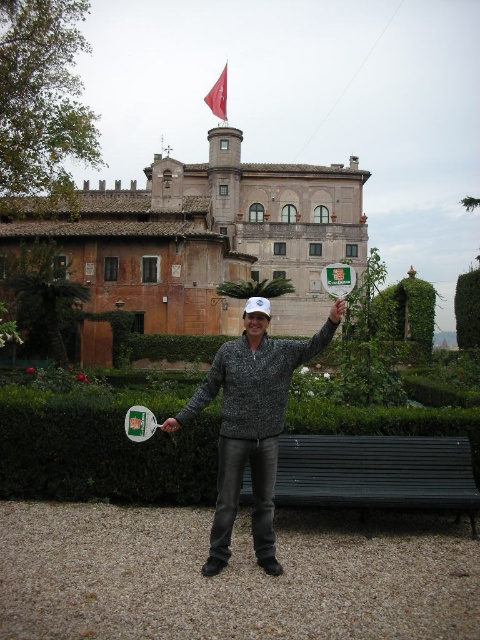
You are a photographer trying to capture the man in the speckled sweater at center and the green leafy hedge at center in the same frame. Which object is shorter?

The speckled sweater at center is shorter than the green leafy hedge at center.

You are a photographer trying to capture the brown stone building at upper center and the speckled sweater at center in the same frame. Based on their positions, which object should you focus on first to ensure both are in focus?

The brown stone building at upper center should be focused on first since the speckled sweater at center is behind it, meaning adjusting focus starting from the farther object will help both be in focus.

Based on the photo, you are a photographer trying to capture a photo of the man in front of the historic building. The speckled sweater at center and the black metal bench at lower center are both in the frame. Which object is positioned higher in the image?

The speckled sweater at center is much taller than the black metal bench at lower center, so the speckled sweater at center is positioned higher in the image.